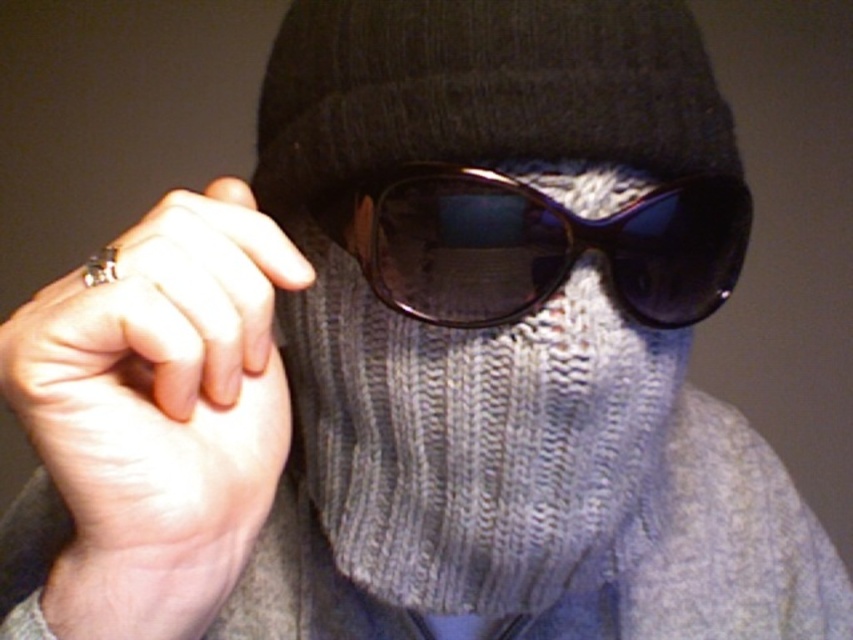
Question: Among these points, which one is farthest from the camera?

Choices:
 (A) (45, 422)
 (B) (691, 202)
 (C) (300, 304)

Answer: (C)

Question: Can you confirm if knitted gray scarf at center is thinner than sunglasses at center?

Choices:
 (A) no
 (B) yes

Answer: (B)

Question: Is knitted gray scarf at center closer to camera compared to sunglasses at center?

Choices:
 (A) no
 (B) yes

Answer: (A)

Question: Which point is closer to the camera?

Choices:
 (A) knitted gray scarf at center
 (B) sunglasses at center

Answer: (B)

Question: Does silver metallic ring at left appear under sunglasses at center?

Choices:
 (A) yes
 (B) no

Answer: (A)

Question: Which point is farther to the camera?

Choices:
 (A) (62, 342)
 (B) (428, 394)

Answer: (B)